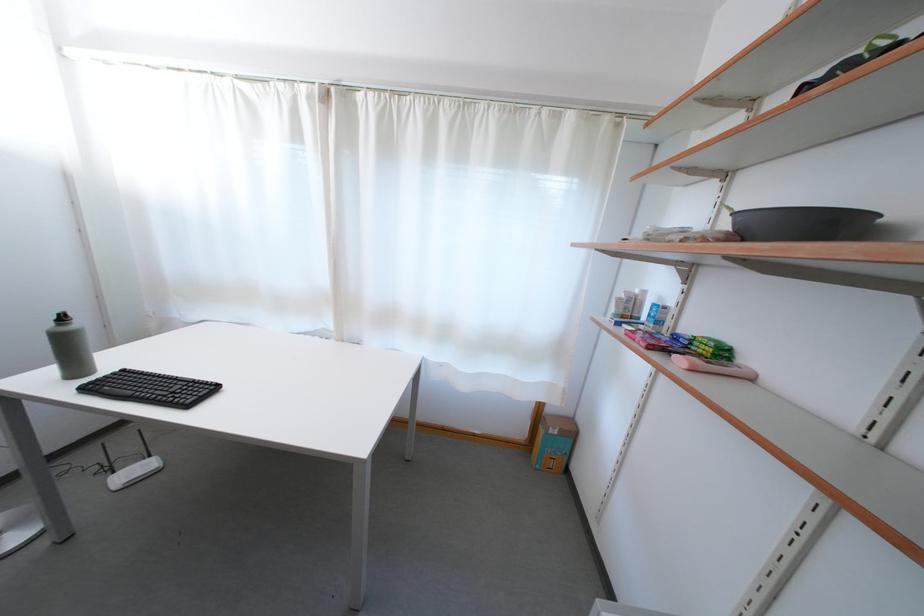
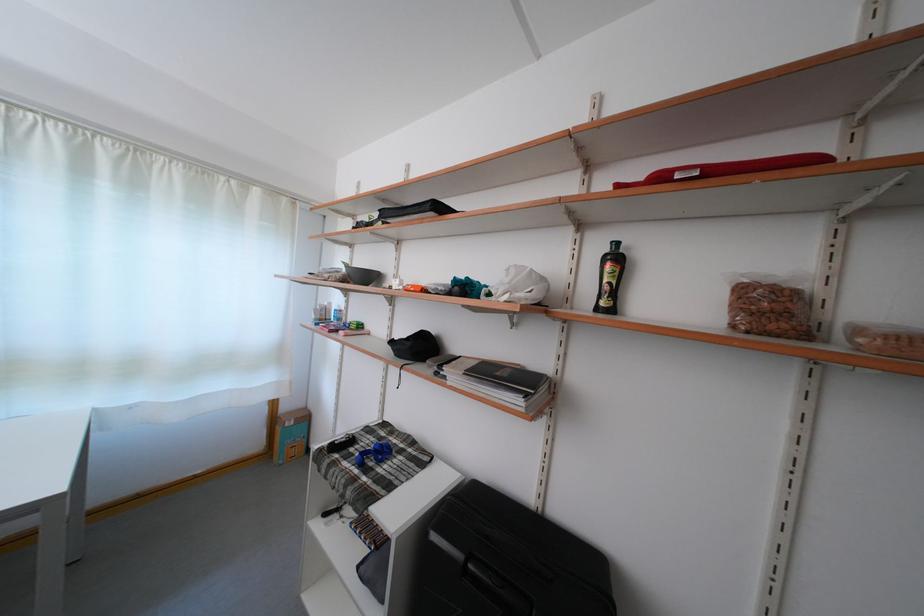
Where in the second image is the point corresponding to point 621,493 from the first image?

(344, 436)